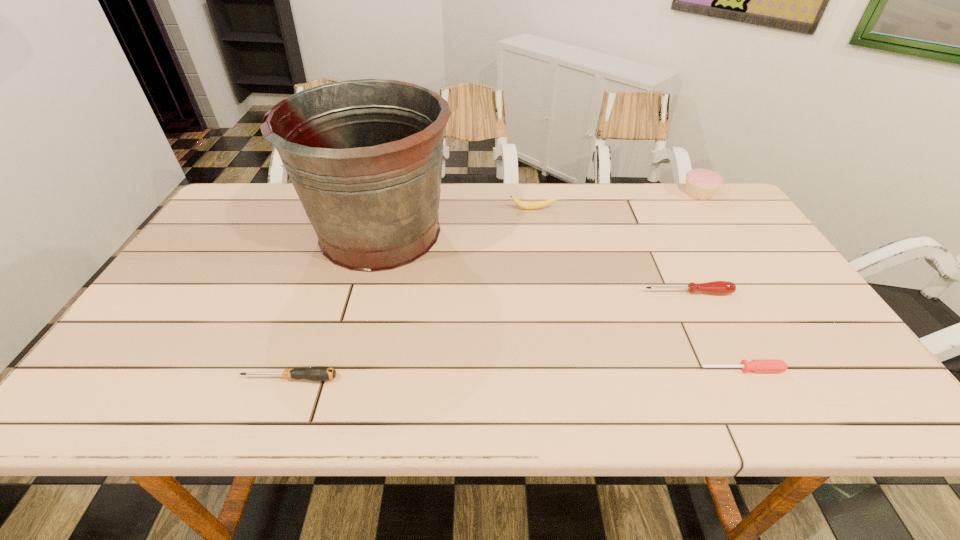
Where is `free space located on the upward curve of the third tallest object`? This screenshot has height=540, width=960. free space located on the upward curve of the third tallest object is located at coordinates (536, 228).

You are a GUI agent. You are given a task and a screenshot of the screen. Output one action in this format:
    pyautogui.click(x=<x>, y=<y>)
    Task: Click on the vacant area located 0.150m on the front of the farthest screwdriver
    
    Given the screenshot: What is the action you would take?
    pyautogui.click(x=713, y=345)

Find the location of a particular element. The image size is (960, 540). free point located on the right of the leftmost screwdriver is located at coordinates (520, 379).

The width and height of the screenshot is (960, 540). What are the coordinates of `free space located on the left of the shortest object` in the screenshot? It's located at (628, 369).

Locate an element on the screen. bucket at the far edge is located at coordinates (365, 156).

The image size is (960, 540). In order to click on cupcake present at the far edge in this screenshot , I will do point(701,184).

What are the coordinates of `banana that is at the far edge` in the screenshot? It's located at (522, 204).

Identify the location of object at the near edge. (317, 373).

You are a GUI agent. You are given a task and a screenshot of the screen. Output one action in this format:
    pyautogui.click(x=<x>, y=<y>)
    Task: Click on the cupcake at the right edge
    The height and width of the screenshot is (540, 960).
    Given the screenshot: What is the action you would take?
    pyautogui.click(x=701, y=184)

Identify the location of screwdriver that is at the right edge. (758, 366).